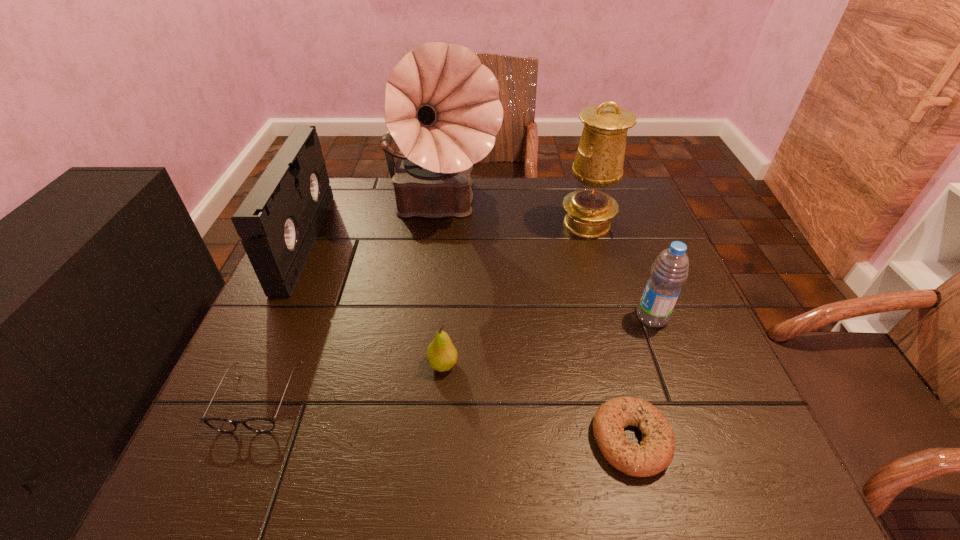
This screenshot has height=540, width=960. I want to click on water bottle positioned at the right edge, so click(x=669, y=271).

At what (x,y) coordinates should I click in order to perform the action: click on bagel located at the right edge. Please return your answer as a coordinate pair (x, y). This screenshot has height=540, width=960. Looking at the image, I should click on 655,453.

Where is `object located at the far left corner`? object located at the far left corner is located at coordinates (279, 220).

Where is `object present at the far right corner`? This screenshot has width=960, height=540. object present at the far right corner is located at coordinates (599, 160).

Find the location of a particular element. The width and height of the screenshot is (960, 540). object that is positioned at the near right corner is located at coordinates (655, 453).

The height and width of the screenshot is (540, 960). Find the location of `free space at the far edge of the desktop`. free space at the far edge of the desktop is located at coordinates coord(535,178).

You are a GUI agent. You are given a task and a screenshot of the screen. Output one action in this format:
    pyautogui.click(x=<x>, y=<y>)
    Task: Click on the vacant position at the near edge of the desktop
    This screenshot has width=960, height=540.
    Given the screenshot: What is the action you would take?
    pyautogui.click(x=407, y=448)

Find the location of a particular element. The height and width of the screenshot is (540, 960). vacant region at the left edge of the desktop is located at coordinates (279, 339).

You are a GUI agent. You are given a task and a screenshot of the screen. Output one action in this format:
    pyautogui.click(x=<x>, y=<y>)
    Task: Click on the free space at the right edge
    This screenshot has width=960, height=540.
    Given the screenshot: What is the action you would take?
    pyautogui.click(x=619, y=274)

In the image, there is a desktop. Where is `vacant area at the far right corner`? This screenshot has height=540, width=960. vacant area at the far right corner is located at coordinates (618, 204).